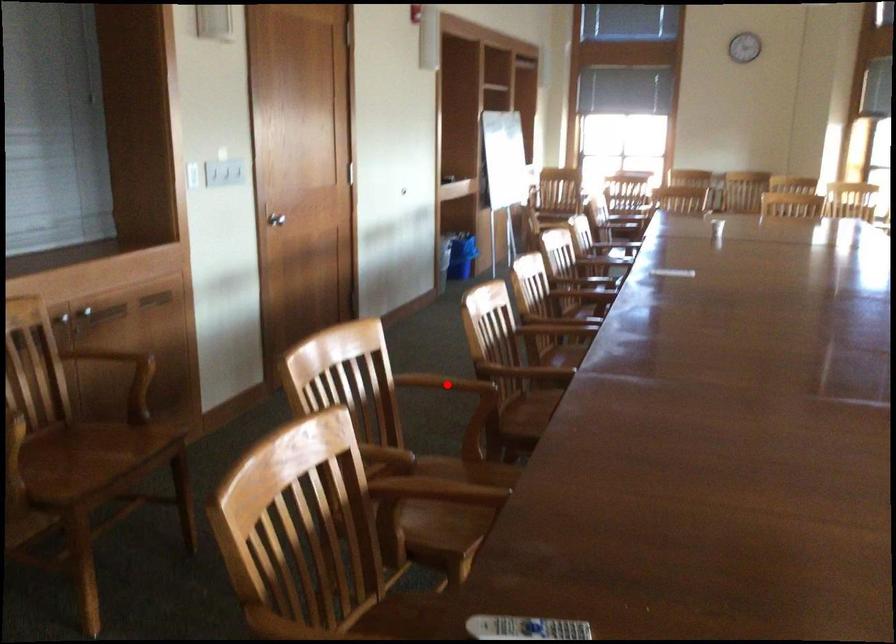
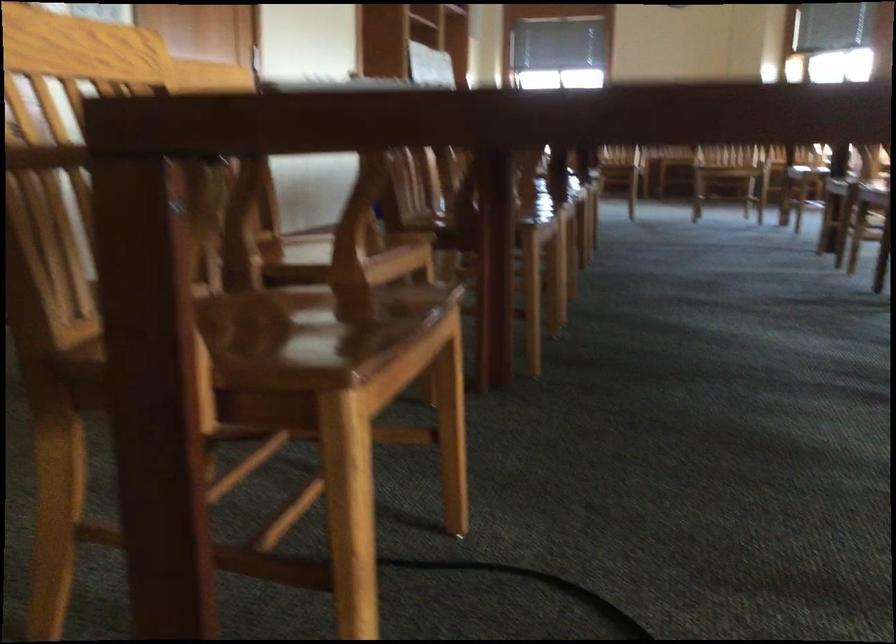
Question: I am providing you with two images of the same scene from different viewpoints. A red point is marked on the first image. At the location where the point appears in image 1, is it still visible in image 2?

Choices:
 (A) Yes
 (B) No

Answer: (B)